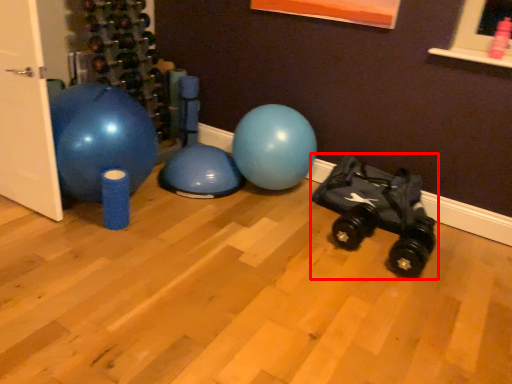
Question: Considering the relative positions of baby carriage (annotated by the red box) and door in the image provided, where is baby carriage (annotated by the red box) located with respect to the staircase?

Choices:
 (A) left
 (B) right

Answer: (B)